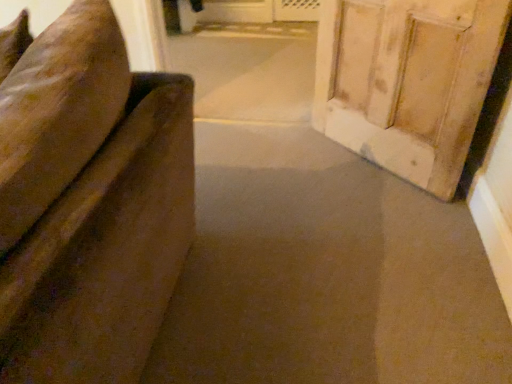
Question: Should I look upward or downward to see wooden door at right?

Choices:
 (A) down
 (B) up

Answer: (B)

Question: From a real-world perspective, is velvet-like brown couch at left positioned under wooden door at right based on gravity?

Choices:
 (A) yes
 (B) no

Answer: (A)

Question: Is wooden door at right at the back of velvet-like brown couch at left?

Choices:
 (A) no
 (B) yes

Answer: (A)

Question: From a real-world perspective, is velvet-like brown couch at left physically above wooden door at right?

Choices:
 (A) yes
 (B) no

Answer: (B)

Question: Does velvet-like brown couch at left turn towards wooden door at right?

Choices:
 (A) yes
 (B) no

Answer: (B)

Question: Is velvet-like brown couch at left located outside wooden door at right?

Choices:
 (A) yes
 (B) no

Answer: (A)

Question: Is there a large distance between velvet-like brown couch at left and wooden door at right?

Choices:
 (A) yes
 (B) no

Answer: (B)

Question: Can you confirm if wooden door at right is bigger than velvet-like brown couch at left?

Choices:
 (A) no
 (B) yes

Answer: (A)

Question: From a real-world perspective, is wooden door at right positioned under velvet-like brown couch at left based on gravity?

Choices:
 (A) no
 (B) yes

Answer: (A)

Question: Considering the relative positions of wooden door at right and velvet-like brown couch at left in the image provided, is wooden door at right behind velvet-like brown couch at left?

Choices:
 (A) no
 (B) yes

Answer: (A)

Question: Does wooden door at right have a greater height compared to velvet-like brown couch at left?

Choices:
 (A) yes
 (B) no

Answer: (A)

Question: Would you say wooden door at right is outside velvet-like brown couch at left?

Choices:
 (A) yes
 (B) no

Answer: (A)

Question: Is wooden door at right thinner than velvet-like brown couch at left?

Choices:
 (A) no
 (B) yes

Answer: (B)

Question: From the image's perspective, is velvet-like brown couch at left positioned above or below wooden door at right?

Choices:
 (A) above
 (B) below

Answer: (A)